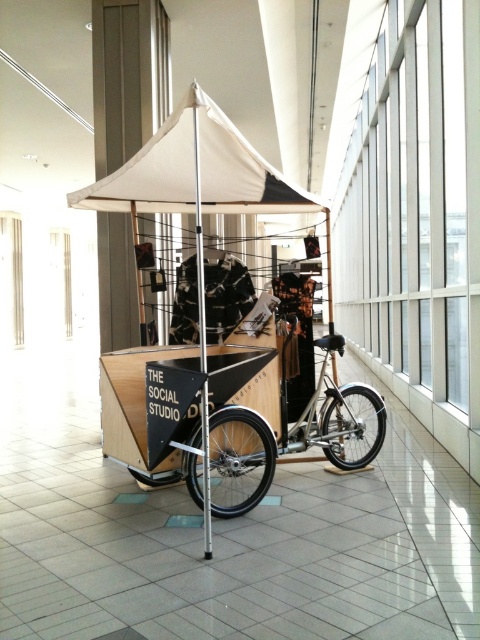
Question: Considering the relative positions of white canvas canopy at center and silver metallic bicycle at center in the image provided, where is white canvas canopy at center located with respect to silver metallic bicycle at center?

Choices:
 (A) below
 (B) above

Answer: (B)

Question: Is white canvas canopy at center to the right of silver metallic bicycle at center from the viewer's perspective?

Choices:
 (A) no
 (B) yes

Answer: (A)

Question: Is white canvas canopy at center below silver metallic bicycle at center?

Choices:
 (A) yes
 (B) no

Answer: (B)